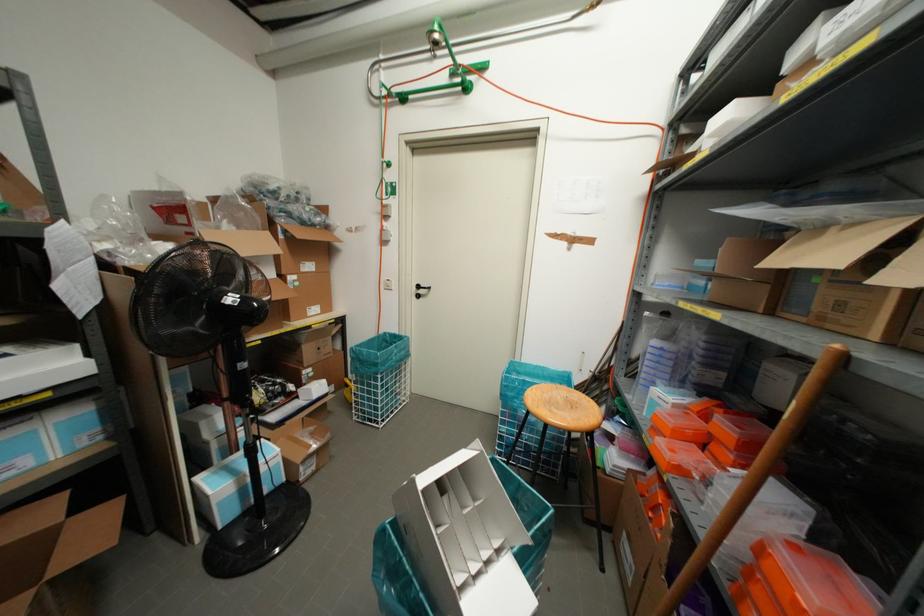
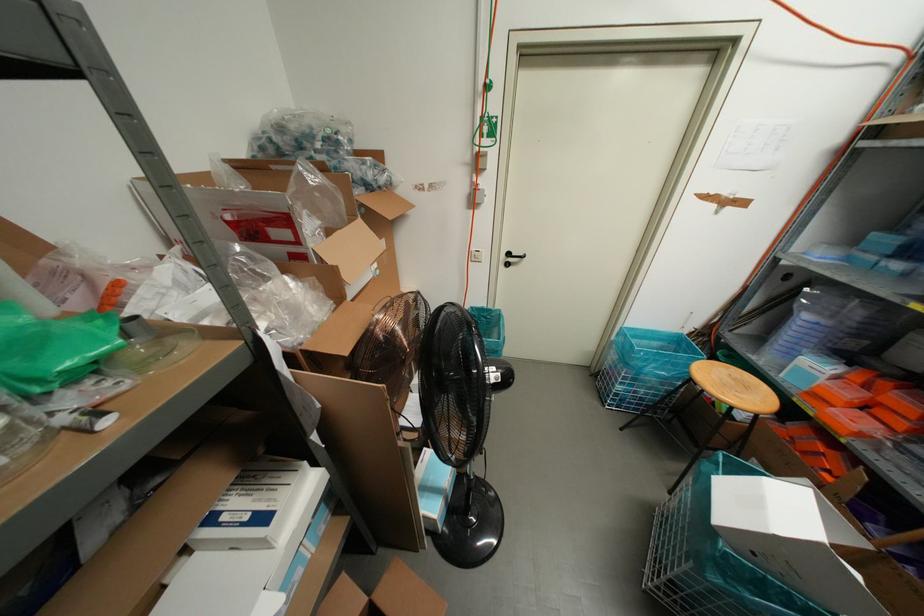
Find the pixel in the second image that matches point (382, 285) in the first image.

(470, 257)